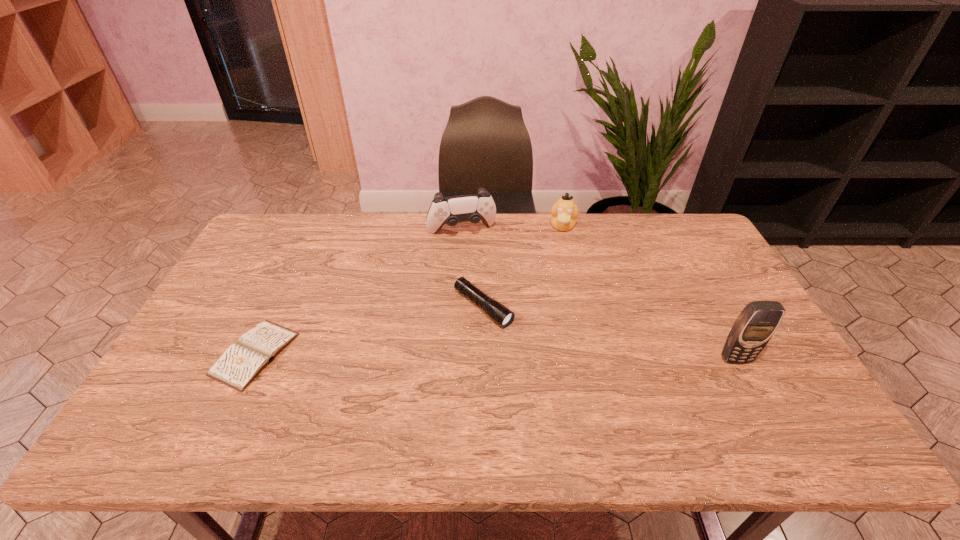
Find the location of a particular element. The height and width of the screenshot is (540, 960). object that stands as the third closest to the fourth tallest object is located at coordinates (238, 366).

Where is `the closest object relative to the duckling`? the closest object relative to the duckling is located at coordinates (472, 208).

You are a GUI agent. You are given a task and a screenshot of the screen. Output one action in this format:
    pyautogui.click(x=<x>, y=<y>)
    Task: Click on the vacant space that satisfies the following two spatial constraints: 1. on the back side of the second shortest object; 2. on the left side of the second object from right to left
    This screenshot has width=960, height=540.
    Given the screenshot: What is the action you would take?
    pyautogui.click(x=483, y=226)